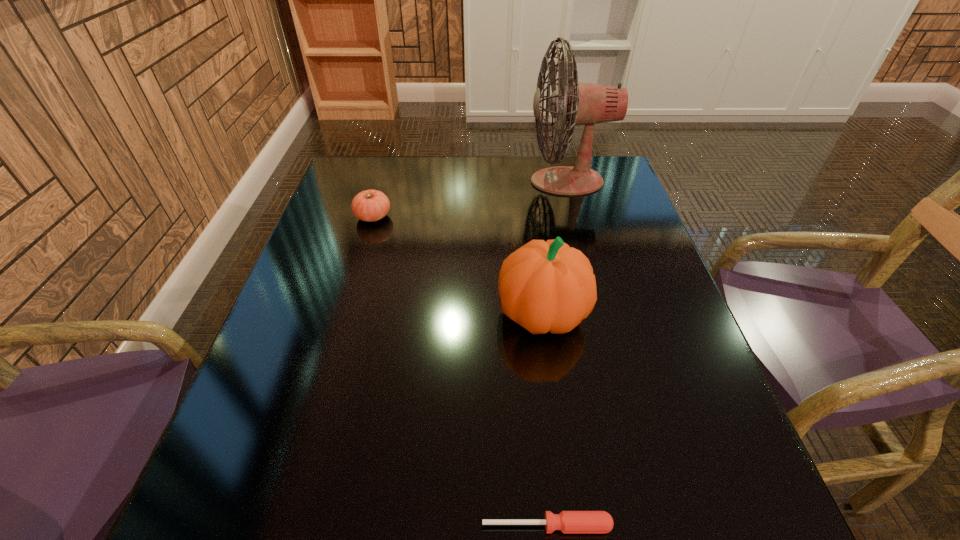
In the image, there is a desktop. What are the coordinates of `free region at the left edge` in the screenshot? It's located at (311, 291).

In order to click on free space at the right edge of the desktop in this screenshot , I will do `click(636, 244)`.

The height and width of the screenshot is (540, 960). I want to click on vacant space at the far left corner of the desktop, so click(x=350, y=181).

The image size is (960, 540). Identify the location of free space at the far right corner. (603, 156).

Image resolution: width=960 pixels, height=540 pixels. In order to click on free space between the tomato and the screwdriver in this screenshot , I will do `click(460, 371)`.

Identify the location of vacant space that is in between the pumpkin and the tomato. Image resolution: width=960 pixels, height=540 pixels. (458, 265).

At what (x,y) coordinates should I click in order to perform the action: click on vacant area that lies between the tomato and the shortest object. Please return your answer as a coordinate pair (x, y). The image size is (960, 540). Looking at the image, I should click on coord(460,371).

Identify the location of vacant point located between the second shortest object and the nearest object. (460, 371).

Locate an element on the screen. The height and width of the screenshot is (540, 960). free point between the leftmost object and the shortest object is located at coordinates (460, 371).

This screenshot has width=960, height=540. Identify the location of vacant space that's between the tallest object and the tomato. (469, 199).